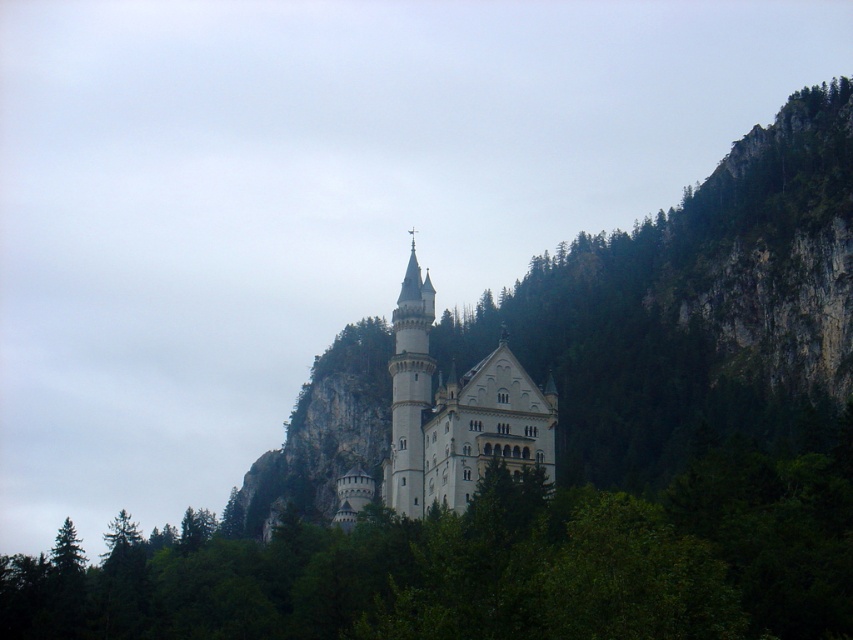
Between point (611, 524) and point (518, 451), which one is positioned behind?

Positioned behind is point (518, 451).

Can you confirm if green leafy tree at center is positioned below white stone castle at center?

Indeed, green leafy tree at center is positioned under white stone castle at center.

Who is more forward, (283, 627) or (486, 419)?

Positioned in front is point (283, 627).

The image size is (853, 640). I want to click on green leafy tree at center, so click(x=486, y=564).

Is white stone castle at center to the left of white stone tower at center from the viewer's perspective?

Incorrect, white stone castle at center is not on the left side of white stone tower at center.

Consider the image. Who is more distant from viewer, (439, 492) or (398, 424)?

Positioned behind is point (398, 424).

This screenshot has width=853, height=640. I want to click on white stone castle at center, so click(x=456, y=413).

Between green leafy tree at center and white stone tower at center, which one appears on the left side from the viewer's perspective?

From the viewer's perspective, green leafy tree at center appears more on the left side.

Does green leafy tree at center appear on the right side of white stone tower at center?

In fact, green leafy tree at center is to the left of white stone tower at center.

Is point (500, 592) closer to camera compared to point (421, 298)?

Yes, point (500, 592) is in front of point (421, 298).

Locate an element on the screen. The image size is (853, 640). green leafy tree at center is located at coordinates (486, 564).